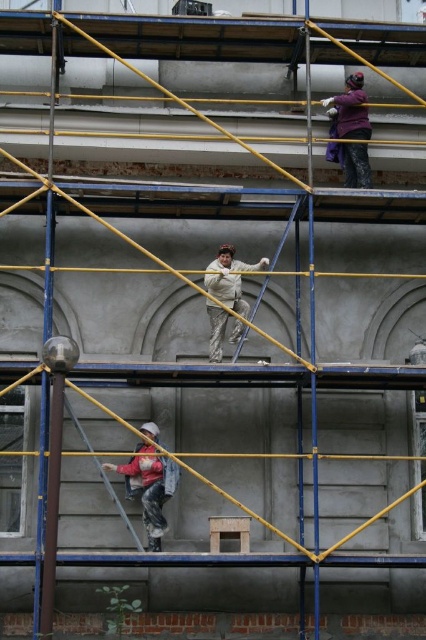
You are a drone operator trying to capture a photo of the construction site. You have two points marked on your screen corresponding to the coordinates point (157,540) and point (224,323). Which point is closer to the camera?

Point (157,540) is closer to the camera than point (224,323).

You are a safety inspector standing at the base of the scaffolding. You need to ensure that the distance between the denim jacket at lower center and the purple matte shirt at upper center is within the recommended 15 meters for safe communication. Is the current distance compliant with this requirement?

The denim jacket at lower center and the purple matte shirt at upper center are 15.10 meters apart from each other, which exceeds the recommended 15 meters for safe communication. Therefore, the distance is not compliant with the requirement.